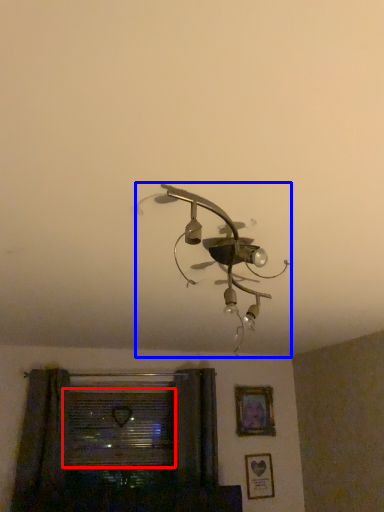
Question: Which of the following is the closest to the observer, window (highlighted by a red box) or lamp (highlighted by a blue box)?

Choices:
 (A) window
 (B) lamp

Answer: (B)